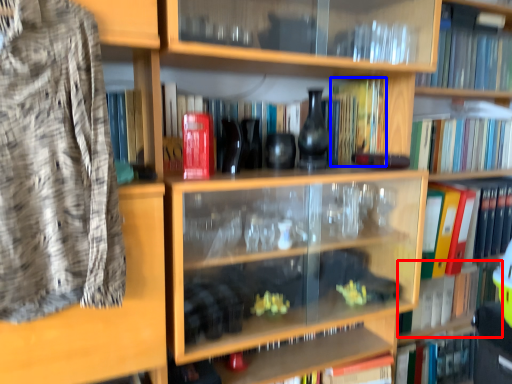
Question: Which object is closer to the camera taking this photo, book (highlighted by a red box) or book (highlighted by a blue box)?

Choices:
 (A) book
 (B) book

Answer: (B)